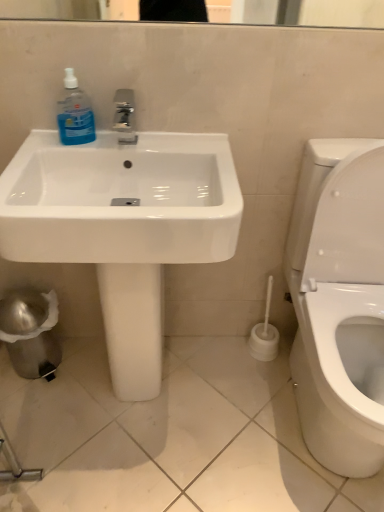
Question: In terms of height, does blue translucent liquid at sink left look taller or shorter compared to white glossy sink at center?

Choices:
 (A) tall
 (B) short

Answer: (B)

Question: Is blue translucent liquid at sink left in front of or behind white glossy sink at center in the image?

Choices:
 (A) behind
 (B) front

Answer: (A)

Question: Is point (76, 81) positioned closer to the camera than point (201, 184)?

Choices:
 (A) closer
 (B) farther

Answer: (A)

Question: Is white glossy sink at center wider or thinner than blue translucent liquid at sink left?

Choices:
 (A) thin
 (B) wide

Answer: (B)

Question: Relative to blue translucent liquid at sink left, is white glossy sink at center in front or behind?

Choices:
 (A) front
 (B) behind

Answer: (A)

Question: Considering the positions of point (135, 281) and point (67, 83), is point (135, 281) closer or farther from the camera than point (67, 83)?

Choices:
 (A) farther
 (B) closer

Answer: (A)

Question: Would you say white glossy sink at center is to the left or to the right of blue translucent liquid at sink left in the picture?

Choices:
 (A) right
 (B) left

Answer: (A)